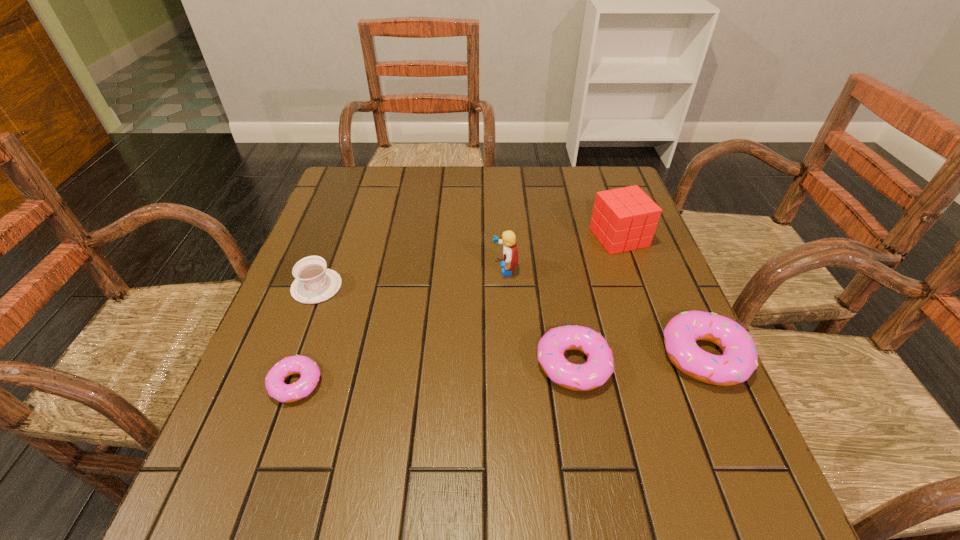
Please point a space for a new doughnut to maintain equal intervals. Please provide its 2D coordinates. Your answer should be formatted as a tuple, i.e. [(x, y)], where the tuple contains the x and y coordinates of a point satisfying the conditions above.

[(437, 374)]